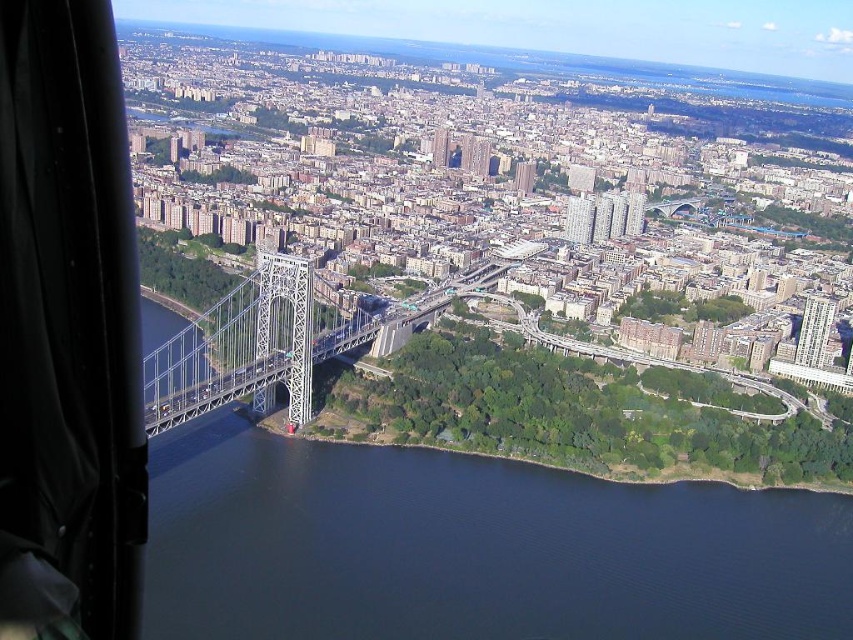
Question: Where is dark blue water at lower center located in relation to white metallic suspension bridge at center in the image?

Choices:
 (A) right
 (B) left

Answer: (A)

Question: Is dark blue water at lower center closer to the viewer compared to white metallic suspension bridge at center?

Choices:
 (A) yes
 (B) no

Answer: (A)

Question: Does dark blue water at lower center have a larger size compared to white metallic suspension bridge at center?

Choices:
 (A) yes
 (B) no

Answer: (A)